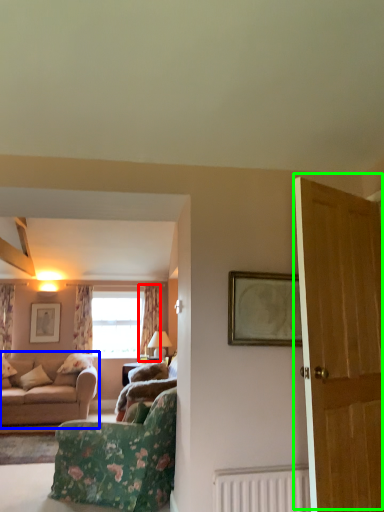
Question: Which object is positioned farthest from curtain (highlighted by a red box)? Select from studio couch (highlighted by a blue box) and door (highlighted by a green box).

Choices:
 (A) studio couch
 (B) door

Answer: (B)